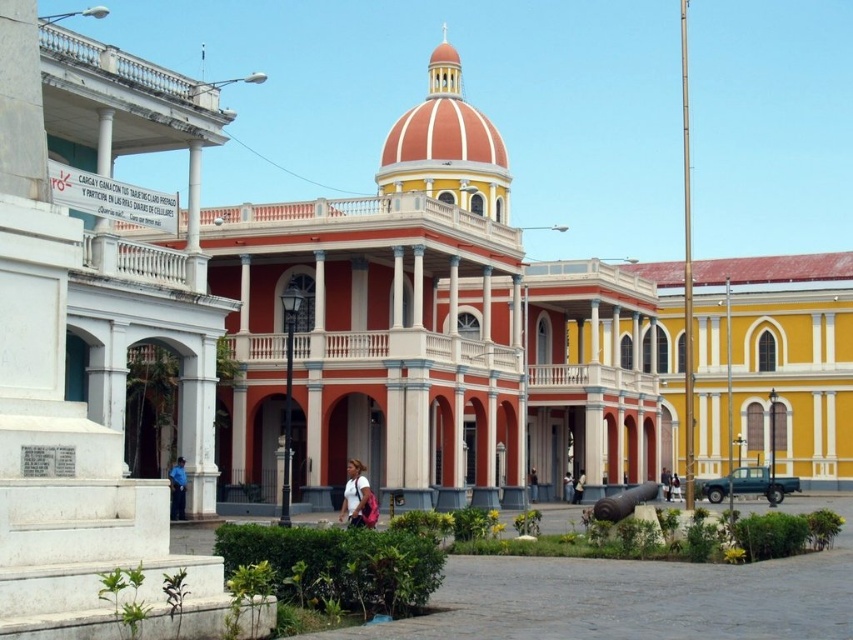
Can you confirm if matte red building at center is taller than white fabric shirt at center?

Correct, matte red building at center is much taller as white fabric shirt at center.

Does matte red building at center have a larger size compared to white fabric shirt at center?

Indeed, matte red building at center has a larger size compared to white fabric shirt at center.

Between point (647, 433) and point (672, 493), which one is positioned in front?

Point (672, 493)

Identify the location of matte red building at center. (428, 332).

Can you confirm if dark blue jeans at center is smaller than white fabric shirt at center?

Yes, dark blue jeans at center is smaller than white fabric shirt at center.

Is dark blue jeans at center positioned behind white fabric shirt at center?

No, it is in front of white fabric shirt at center.

At what (x,y) coordinates should I click in order to perform the action: click on dark blue jeans at center. Please return your answer as a coordinate pair (x, y). This screenshot has width=853, height=640. Looking at the image, I should click on (532, 484).

Can you confirm if white fabric bag at center is positioned to the left of light blue fabric shirt at center?

Correct, you'll find white fabric bag at center to the left of light blue fabric shirt at center.

Which is in front, point (352, 508) or point (570, 496)?

Point (352, 508) is more forward.

Is point (349, 520) less distant than point (572, 496)?

Yes, it is in front of point (572, 496).

This screenshot has width=853, height=640. I want to click on white fabric bag at center, so click(357, 497).